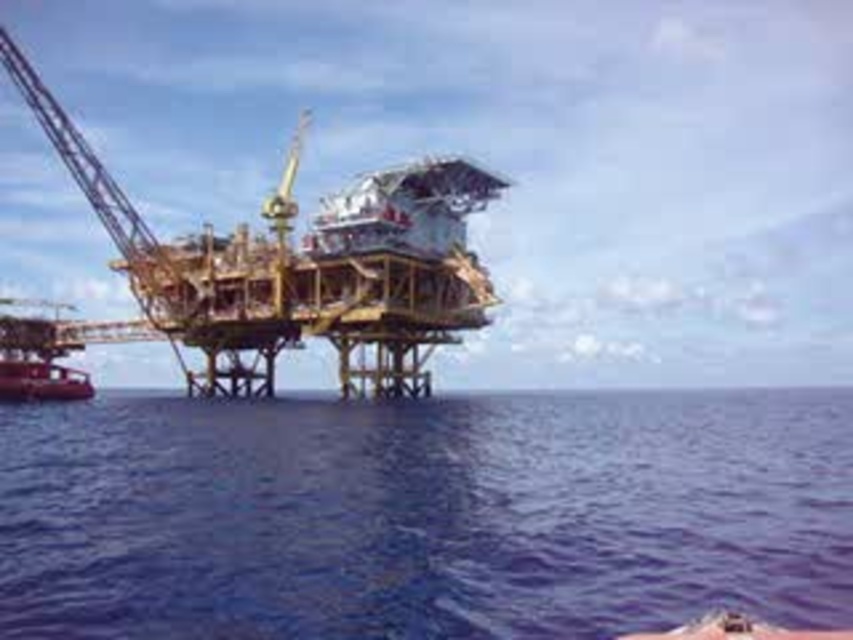
Does blue water at center have a greater height compared to metallic red boat at lower left?

In fact, blue water at center may be shorter than metallic red boat at lower left.

I want to click on blue water at center, so click(424, 515).

Is point (706, 401) positioned after point (44, 394)?

Yes, it is behind point (44, 394).

Image resolution: width=853 pixels, height=640 pixels. Find the location of `blue water at center`. blue water at center is located at coordinates (424, 515).